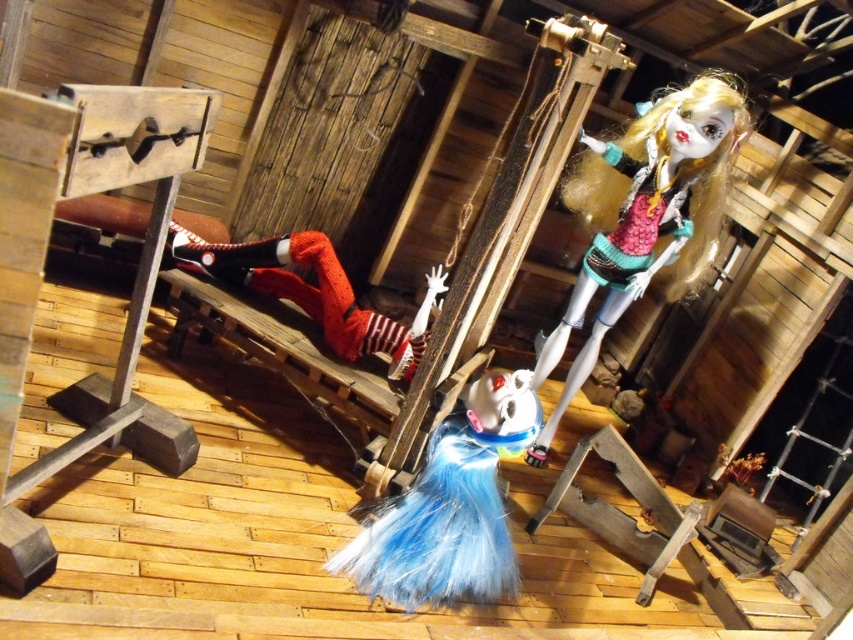
Question: Does shiny teal fabric doll at upper right appear on the right side of blue fuzzy doll at center?

Choices:
 (A) no
 (B) yes

Answer: (B)

Question: Which point appears farthest from the camera in this image?

Choices:
 (A) (486, 474)
 (B) (645, 273)
 (C) (252, 257)

Answer: (C)

Question: Which object is closer to the camera taking this photo?

Choices:
 (A) matte red plush doll at center
 (B) shiny teal fabric doll at upper right
 (C) blue fuzzy doll at center

Answer: (C)

Question: Can you confirm if shiny teal fabric doll at upper right is positioned to the right of matte red plush doll at center?

Choices:
 (A) yes
 (B) no

Answer: (A)

Question: Which of the following is the closest to the observer?

Choices:
 (A) (688, 97)
 (B) (364, 337)

Answer: (A)

Question: Can you confirm if shiny teal fabric doll at upper right is bigger than blue fuzzy doll at center?

Choices:
 (A) no
 (B) yes

Answer: (B)